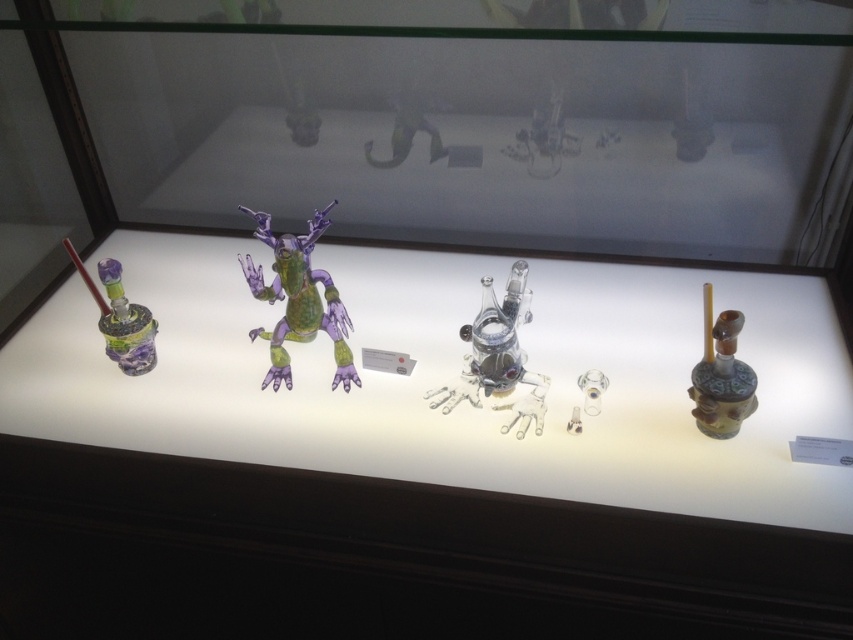
You are an art curator inspecting the display case. You need to determine which object is taller between the translucent purple toy at center and the transparent glass frog at center. Which one is taller?

The translucent purple toy at center is taller than the transparent glass frog at center according to the description provided.

You are a visitor at the exhibition and want to take a photo of both the translucent purple toy at center and the transparent glass frog at center. Since the display case is lit from below, which object should you focus on first to ensure proper lighting in your photo?

The translucent purple toy at center is located above the transparent glass frog at center. Since the display case is lit from below, the lower object might be shadowed by the upper one. Focus on the transparent glass frog at center first to avoid shadows from the translucent purple toy at center blocking its lighting.